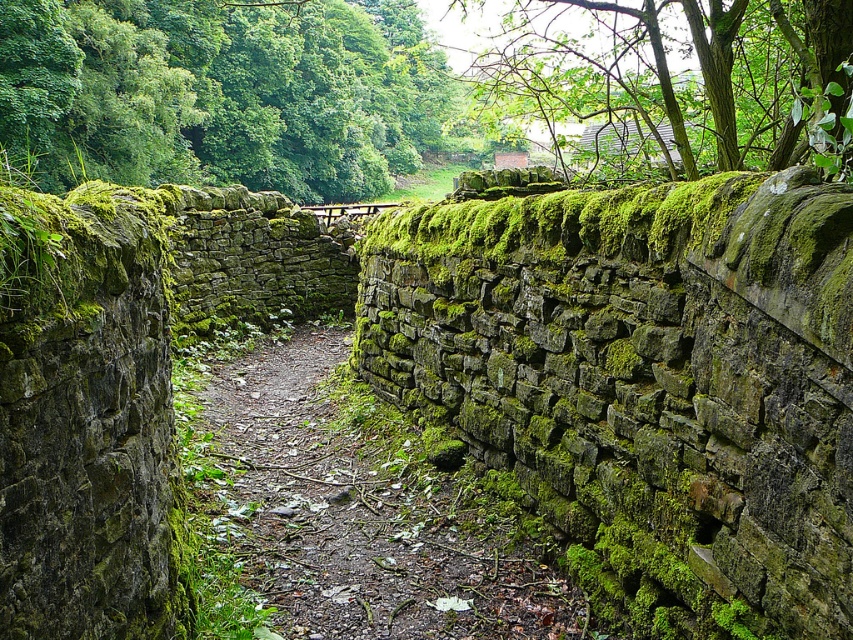
Is point (612, 170) in front of point (706, 224)?

No.

Which is more to the left, green leafy tree at upper right or green mossy stone wall at upper center?

Positioned to the left is green mossy stone wall at upper center.

The image size is (853, 640). Identify the location of green leafy tree at upper right. (x=677, y=83).

Which of these two, green leafy tree at upper left or green mossy stone path at center, stands shorter?

With less height is green mossy stone path at center.

Which is in front, point (305, 51) or point (378, 472)?

Point (378, 472) is more forward.

Measure the distance between point (329, 147) and camera.

37.81 meters

You are a GUI agent. You are given a task and a screenshot of the screen. Output one action in this format:
    pyautogui.click(x=<x>, y=<y>)
    Task: Click on the green leafy tree at upper left
    Image resolution: width=853 pixels, height=640 pixels.
    Given the screenshot: What is the action you would take?
    pyautogui.click(x=221, y=92)

Is point (227, 476) positioned in front of point (647, 236)?

No, (227, 476) is further to viewer.

This screenshot has height=640, width=853. I want to click on green mossy stone path at center, so click(363, 509).